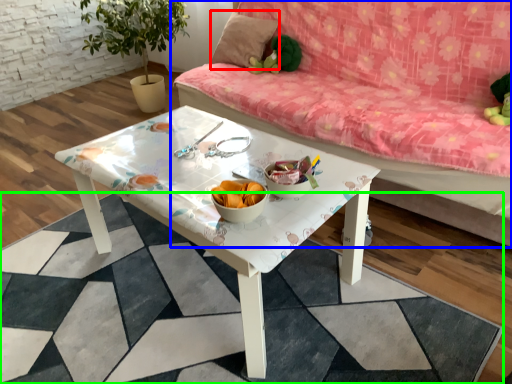
Question: Estimate the real-world distances between objects in this image. Which object is farther from pillow (highlighted by a red box), studio couch (highlighted by a blue box) or square (highlighted by a green box)?

Choices:
 (A) studio couch
 (B) square

Answer: (B)